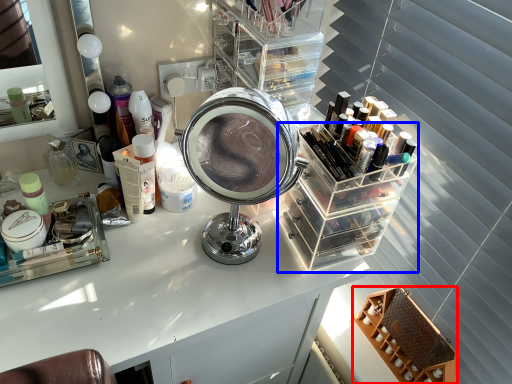
Question: Which of the following is the farthest to the observer, shelf (highlighted by a red box) or glass box (highlighted by a blue box)?

Choices:
 (A) shelf
 (B) glass box

Answer: (A)